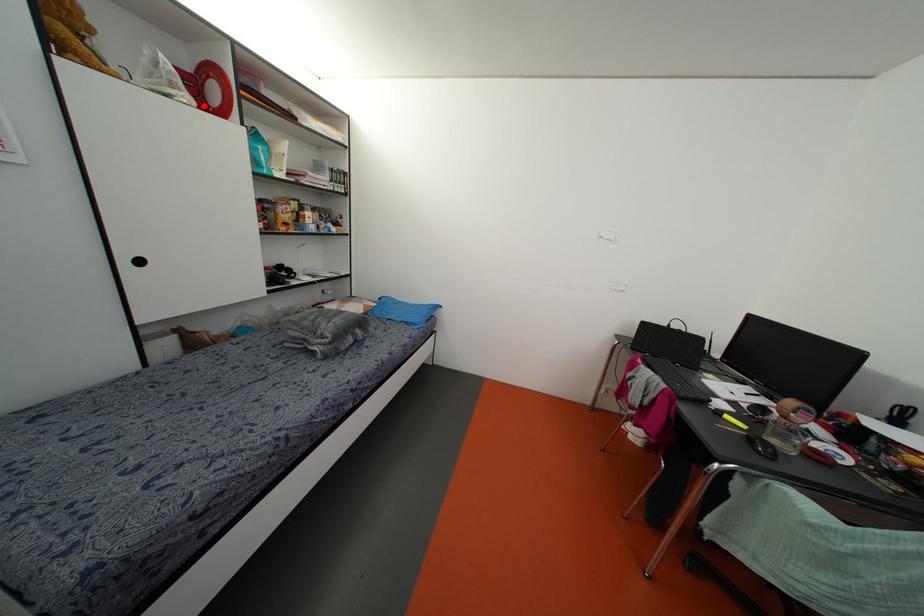
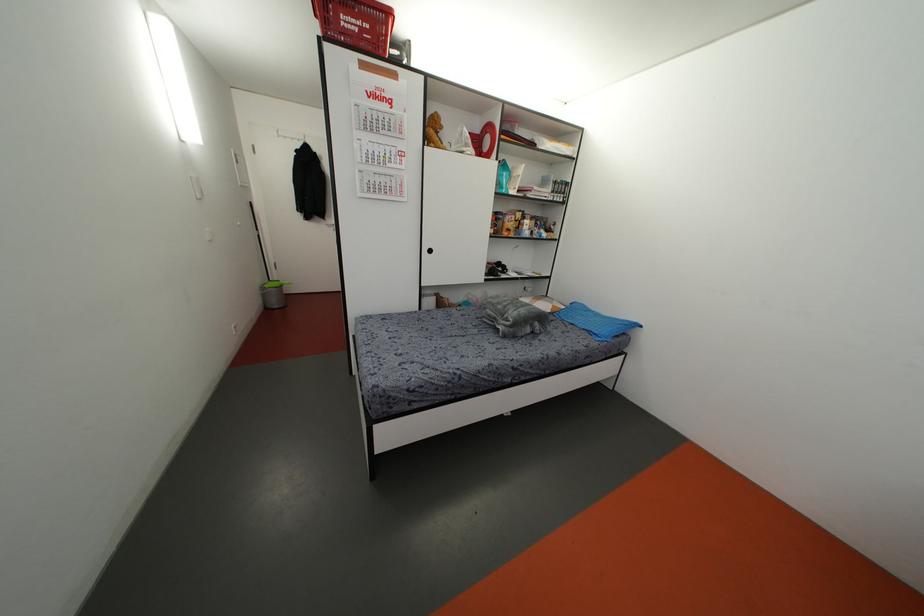
Question: I am providing you with two images of the same scene from different viewpoints. In image1, a red point is highlighted. Considering the same 3D point in image2, which of the following is correct?

Choices:
 (A) It is closer
 (B) It is farther

Answer: (A)